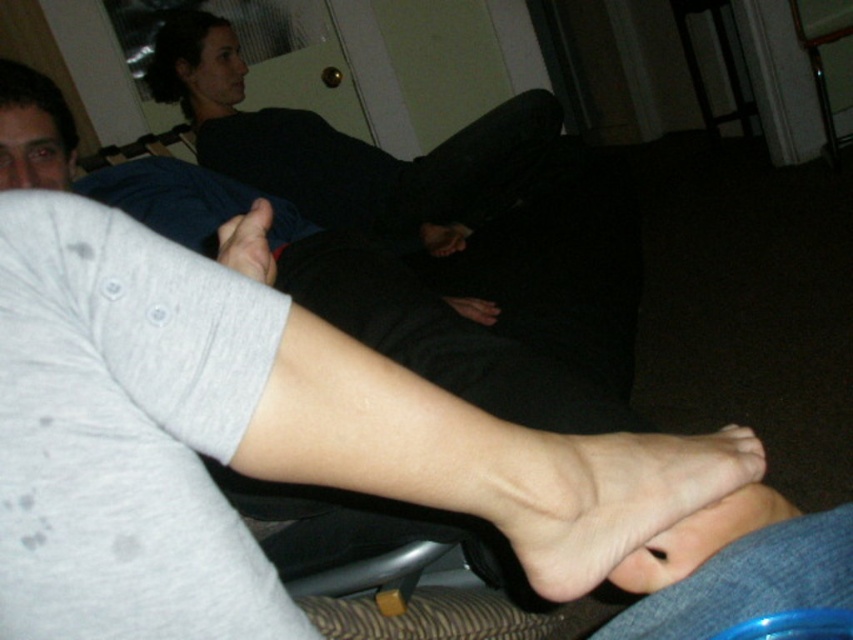
Can you confirm if skinny white foot at lower center is wider than smooth skin foot at lower center?

Indeed, skinny white foot at lower center has a greater width compared to smooth skin foot at lower center.

Is skinny white foot at lower center shorter than smooth skin foot at lower center?

In fact, skinny white foot at lower center may be taller than smooth skin foot at lower center.

Identify the location of skinny white foot at lower center. This screenshot has width=853, height=640. (602, 493).

Does skinny white foot at lower center have a larger size compared to matte skin toe at center?

Correct, skinny white foot at lower center is larger in size than matte skin toe at center.

Is skinny white foot at lower center thinner than matte skin toe at center?

No, skinny white foot at lower center is not thinner than matte skin toe at center.

Is point (689, 477) behind point (260, 198)?

No.

Locate an element on the screen. The width and height of the screenshot is (853, 640). skinny white foot at lower center is located at coordinates (602, 493).

Who is taller, smooth skin foot at lower center or matte skin toe at center?

Standing taller between the two is smooth skin foot at lower center.

Does smooth skin foot at lower center appear on the right side of matte skin toe at center?

Yes, smooth skin foot at lower center is to the right of matte skin toe at center.

Locate an element on the screen. The height and width of the screenshot is (640, 853). smooth skin foot at lower center is located at coordinates (699, 538).

The image size is (853, 640). What are the coordinates of `smooth skin foot at lower center` in the screenshot? It's located at (699, 538).